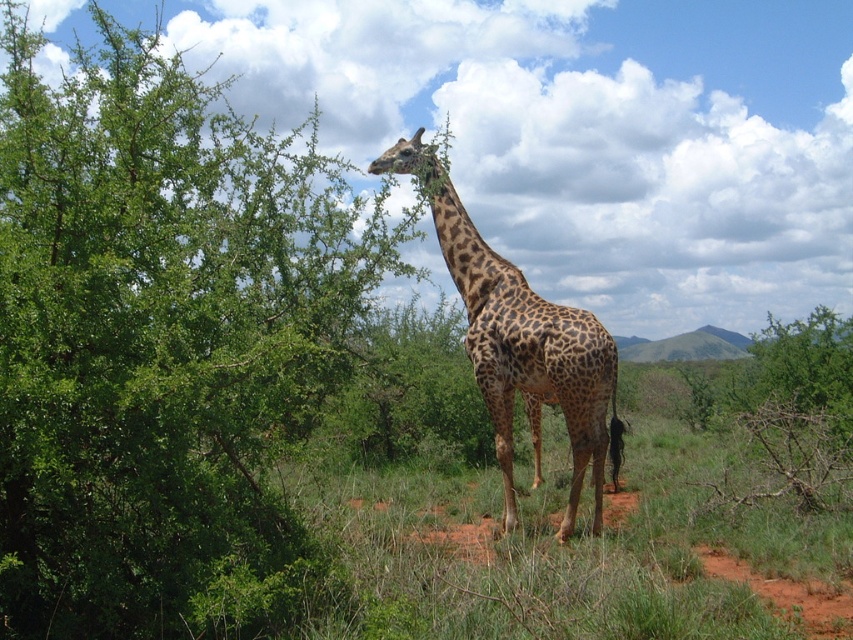
Can you confirm if green leafy tree at upper left is positioned to the left of spotted fur giraffe at center?

Indeed, green leafy tree at upper left is positioned on the left side of spotted fur giraffe at center.

You are a GUI agent. You are given a task and a screenshot of the screen. Output one action in this format:
    pyautogui.click(x=<x>, y=<y>)
    Task: Click on the green leafy tree at upper left
    The width and height of the screenshot is (853, 640).
    Given the screenshot: What is the action you would take?
    pyautogui.click(x=161, y=342)

Between point (318, 218) and point (453, 196), which one is positioned in front?

Point (318, 218) is more forward.

Where is `green leafy tree at upper left`? green leafy tree at upper left is located at coordinates (161, 342).